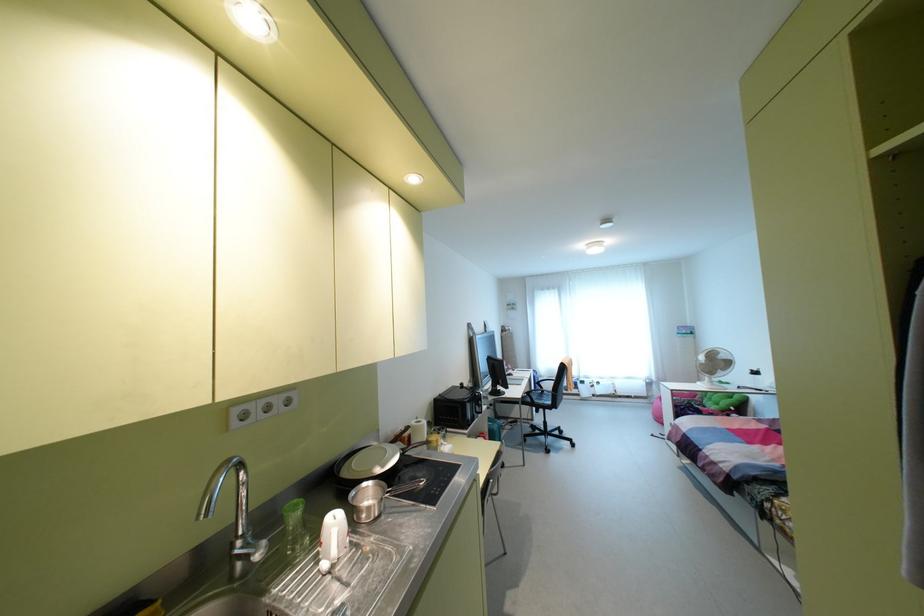
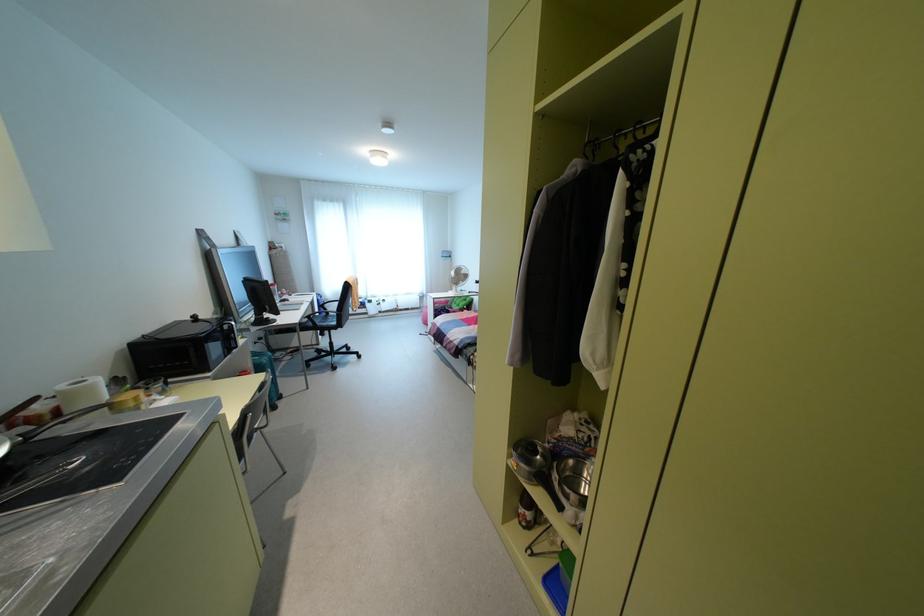
Locate, in the second image, the point that corresponds to point 412,423 in the first image.

(62, 387)